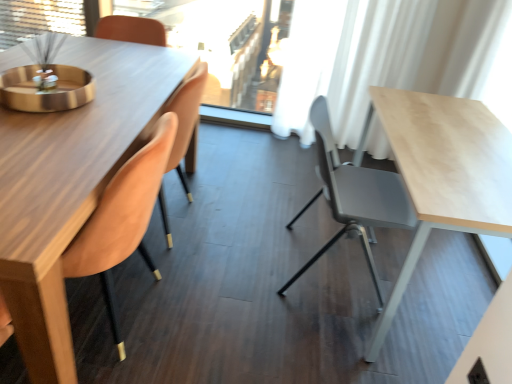
This screenshot has width=512, height=384. I want to click on unoccupied area in front of matte gray chair at center, which is the 1th chair from right to left, so click(343, 342).